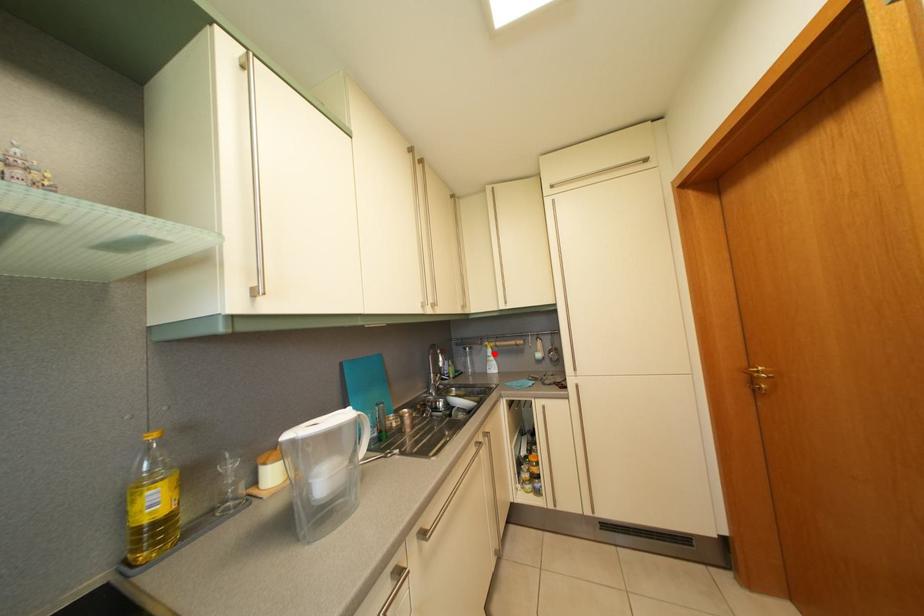
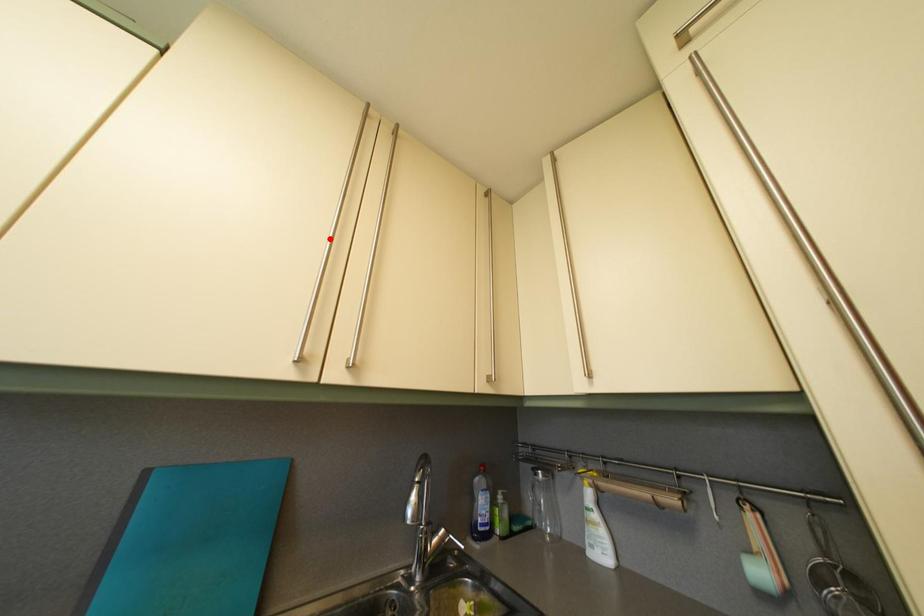
I am providing you with two images of the same scene from different viewpoints. A red point is marked on the first image and another point is marked on the second image. Is the marked point in image1 the same physical position as the marked point in image2?

No